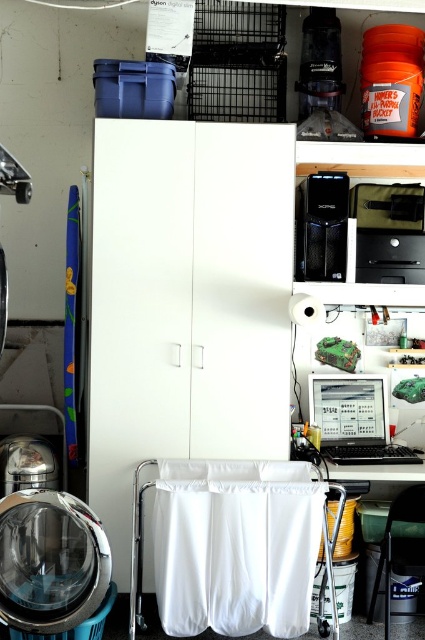
You are organizing items in the storage area and need to place a new item between the white fabric laundry at lower center and the matte black computer at center. Which object should you place the item closer to if you want it to be nearer to the viewer?

You should place the item closer to the white fabric laundry at lower center because it is already closer to the viewer than the matte black computer at center.